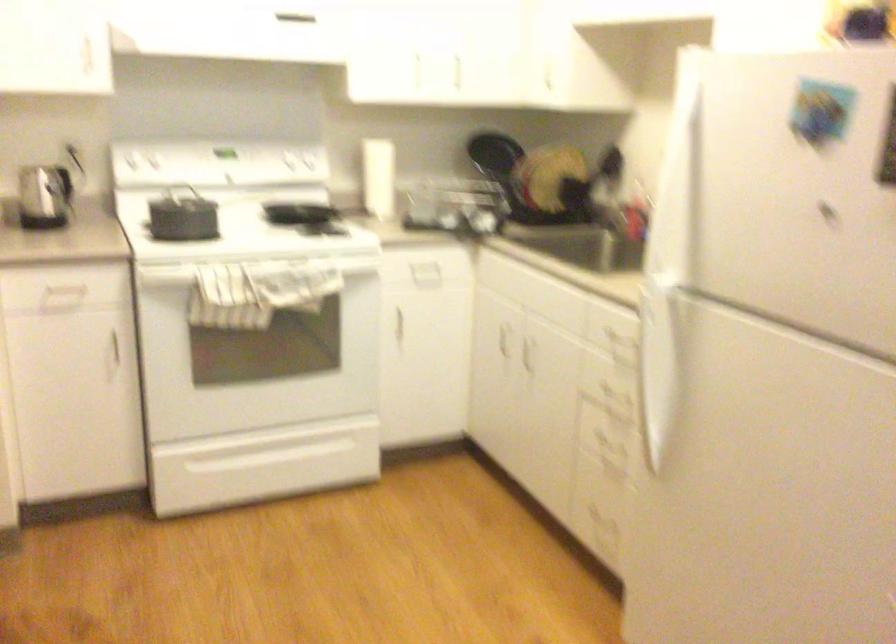
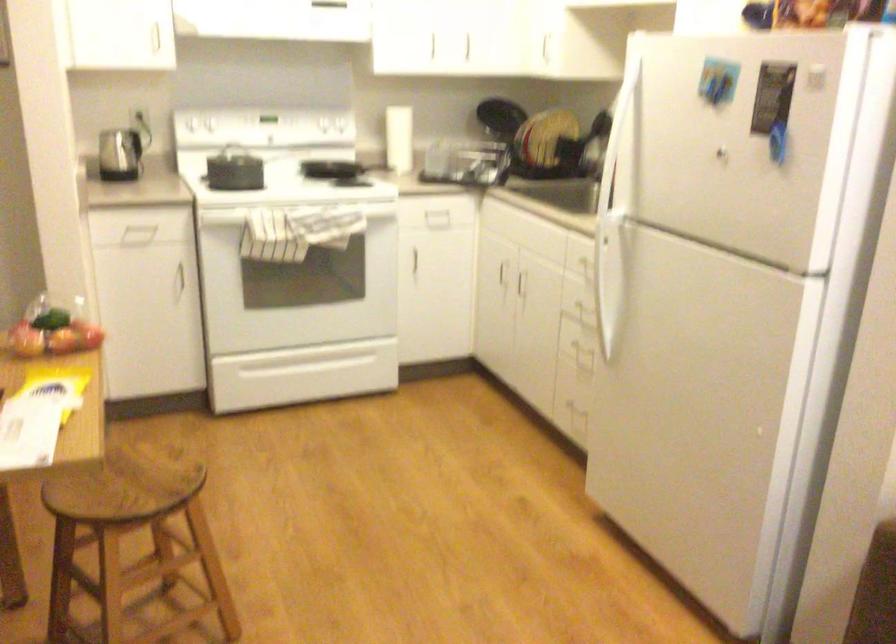
The point at [147,166] is marked in the first image. Where is the corresponding point in the second image?

(200, 122)